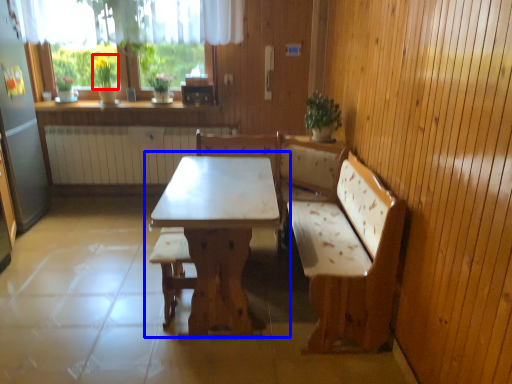
Question: Which object appears closest to the camera in this image, plant (highlighted by a red box) or table (highlighted by a blue box)?

Choices:
 (A) plant
 (B) table

Answer: (B)